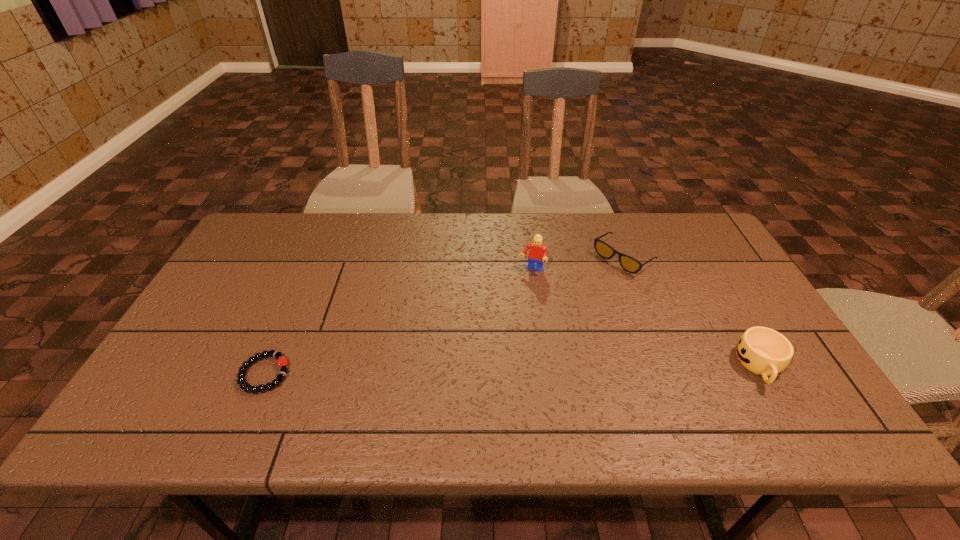
Find the location of a particular element. vacant space on the desktop that is between the leftmost object and the cup and is positioned on the front-facing side of the Lego is located at coordinates (496, 370).

Locate an element on the screen. The image size is (960, 540). free space on the desktop that is between the bracelet and the rightmost object and is positioned on the front-facing side of the third object from left to right is located at coordinates (468, 370).